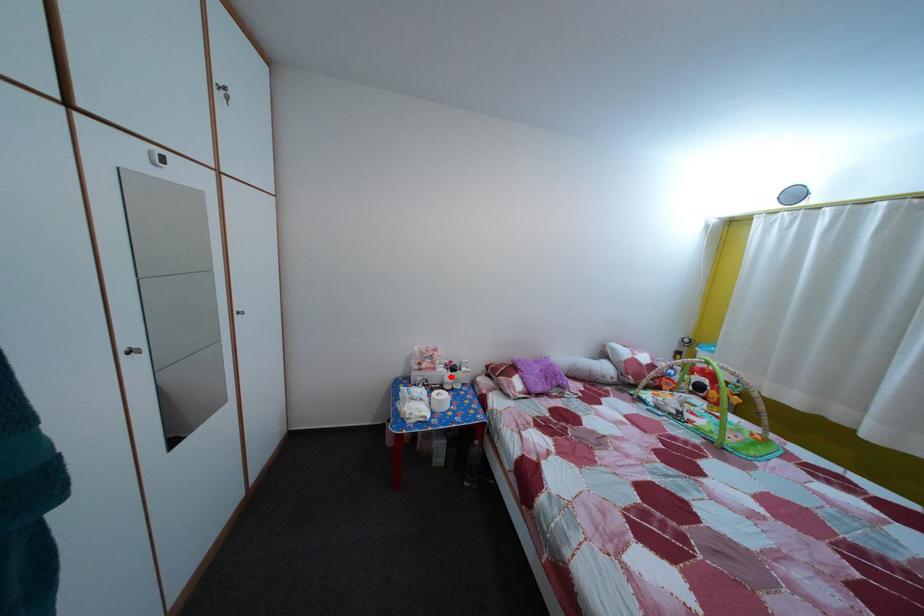
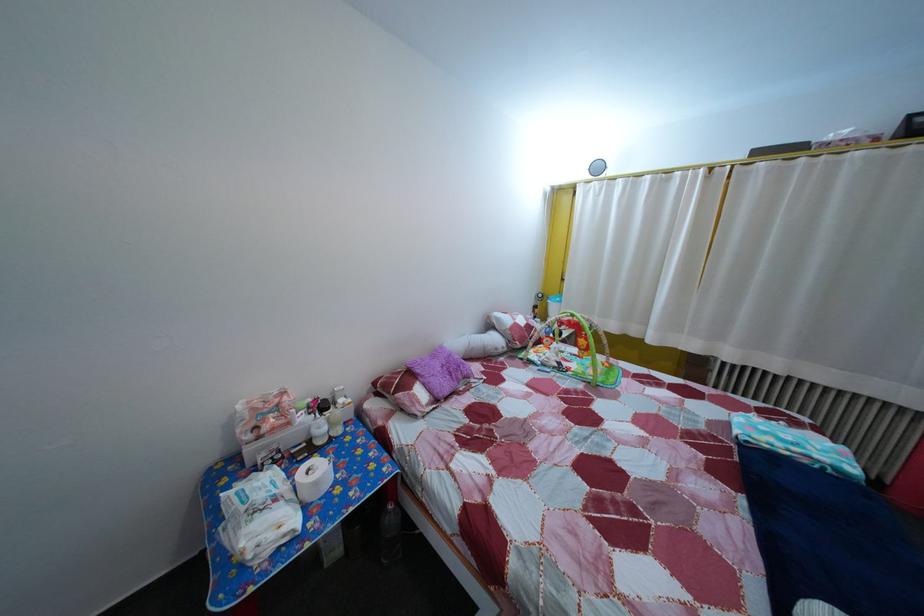
Question: I am providing you with two images of the same scene from different viewpoints. In image1, a red point is highlighted. Considering the same 3D point in image2, which of the following is correct?

Choices:
 (A) It is closer
 (B) It is farther

Answer: (A)